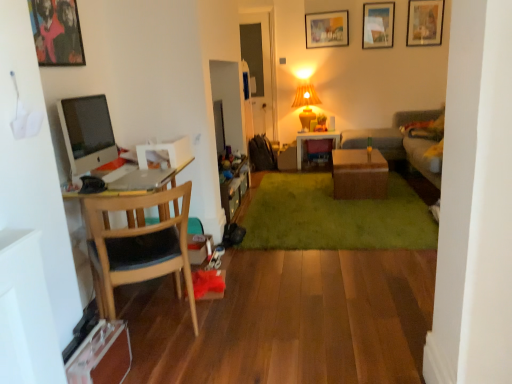
Question: Is wooden picture frame at upper center, the fourth picture frame viewed from the front, wider or thinner than wooden cabinet at center?

Choices:
 (A) thin
 (B) wide

Answer: (A)

Question: From a real-world perspective, relative to wooden cabinet at center, is wooden picture frame at upper center, the fourth picture frame viewed from the front, vertically above or below?

Choices:
 (A) below
 (B) above

Answer: (B)

Question: Considering the real-world distances, which object is closest to the wooden cabinet at center?

Choices:
 (A) wooden picture frame at upper center, which is the third picture frame in top-to-bottom order
 (B) green plush rug at center
 (C) brown wicker table at center, which appears as the second table when viewed from the back
 (D) metallic framed artwork at upper left, which is the 1th picture frame from left to right
 (E) gray fabric couch at right

Answer: (B)

Question: Which is farther from the gray fabric couch at right?

Choices:
 (A) wooden table at center, which appears as the second table when viewed from the front
 (B) metallic framed artwork at upper left, which is the fourth picture frame in right-to-left order
 (C) yellow fabric lampshade at upper center
 (D) brown wicker table at center, arranged as the 1th table when viewed from the front
 (E) wooden chair at left

Answer: (B)